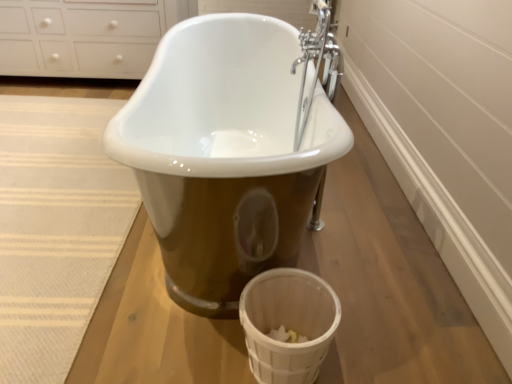
What do you see at coordinates (288, 324) in the screenshot? Image resolution: width=512 pixels, height=384 pixels. I see `white woven basket at lower right` at bounding box center [288, 324].

What are the coordinates of `white glossy cabinet at upper left` in the screenshot? It's located at pos(85,36).

Find the location of a particular element. Image resolution: width=512 pixels, height=384 pixels. white woven basket at lower right is located at coordinates (288, 324).

Is white woven basket at lower right looking in the opposite direction of white glossy cabinet at upper left?

That's not correct — white woven basket at lower right is not looking away from white glossy cabinet at upper left.

From the image's perspective, is white woven basket at lower right positioned above or below white glossy cabinet at upper left?

white woven basket at lower right is situated lower than white glossy cabinet at upper left in the image.

Consider the image. Does white woven basket at lower right have a greater height compared to white glossy cabinet at upper left?

In fact, white woven basket at lower right may be shorter than white glossy cabinet at upper left.

From the image's perspective, which is above, beige woven rug at lower left or white woven basket at lower right?

beige woven rug at lower left, from the image's perspective.

From the picture: Is beige woven rug at lower left with white woven basket at lower right?

beige woven rug at lower left and white woven basket at lower right are clearly separated.

From a real-world perspective, is beige woven rug at lower left beneath white woven basket at lower right?

Yes, from a real-world perspective, beige woven rug at lower left is below white woven basket at lower right.

Is white woven basket at lower right in contact with beige woven rug at lower left?

white woven basket at lower right and beige woven rug at lower left are clearly separated.

Does point (257, 343) appear closer or farther from the camera than point (7, 158)?

Point (257, 343) appears to be closer to the viewer than point (7, 158).

Is white woven basket at lower right positioned with its back to beige woven rug at lower left?

white woven basket at lower right is not turned away from beige woven rug at lower left.

Is white glossy cabinet at upper left with beige woven rug at lower left?

No, white glossy cabinet at upper left is not touching beige woven rug at lower left.

Considering the positions of objects white glossy cabinet at upper left and beige woven rug at lower left in the image provided, who is more to the right, white glossy cabinet at upper left or beige woven rug at lower left?

Positioned to the right is beige woven rug at lower left.

Who is shorter, white glossy cabinet at upper left or beige woven rug at lower left?

Standing shorter between the two is beige woven rug at lower left.

Is beige woven rug at lower left shorter than white glossy cabinet at upper left?

Yes, beige woven rug at lower left is shorter than white glossy cabinet at upper left.

Does beige woven rug at lower left touch white glossy cabinet at upper left?

There is a gap between beige woven rug at lower left and white glossy cabinet at upper left.

Is beige woven rug at lower left outside of white glossy cabinet at upper left?

beige woven rug at lower left is positioned outside white glossy cabinet at upper left.

From the image's perspective, does beige woven rug at lower left appear lower than white glossy cabinet at upper left?

Indeed, from the image's perspective, beige woven rug at lower left is shown beneath white glossy cabinet at upper left.

Is white glossy cabinet at upper left oriented towards white woven basket at lower right?

Yes, white glossy cabinet at upper left is aimed at white woven basket at lower right.

In the image, there is a white woven basket at lower right. Find the location of `cabinetry above it (from the image's perspective)`. cabinetry above it (from the image's perspective) is located at coordinates (85, 36).

Considering their positions, is white glossy cabinet at upper left located in front of or behind white woven basket at lower right?

Clearly, white glossy cabinet at upper left is behind white woven basket at lower right.

What's the angular difference between white glossy cabinet at upper left and white woven basket at lower right's facing directions?

The angle between the facing direction of white glossy cabinet at upper left and the facing direction of white woven basket at lower right is 89 degrees.

Where is `cabinetry on the left of white woven basket at lower right`? Image resolution: width=512 pixels, height=384 pixels. cabinetry on the left of white woven basket at lower right is located at coordinates (85, 36).

The height and width of the screenshot is (384, 512). In order to click on basket below the beige woven rug at lower left (from the image's perspective) in this screenshot , I will do `click(288, 324)`.

From the image, which object appears to be farther from beige woven rug at lower left, white glossy cabinet at upper left or white woven basket at lower right?

white glossy cabinet at upper left.

Based on their spatial positions, is beige woven rug at lower left or white glossy cabinet at upper left further from white woven basket at lower right?

white glossy cabinet at upper left is positioned further to the anchor white woven basket at lower right.

Looking at this image, which object lies nearer to the anchor point white glossy cabinet at upper left, beige woven rug at lower left or white woven basket at lower right?

beige woven rug at lower left.

From the image, which object appears to be farther from beige woven rug at lower left, white woven basket at lower right or white glossy cabinet at upper left?

white glossy cabinet at upper left.

Estimate the real-world distances between objects in this image. Which object is closer to white woven basket at lower right, white glossy cabinet at upper left or beige woven rug at lower left?

Based on the image, beige woven rug at lower left appears to be nearer to white woven basket at lower right.

Based on their spatial positions, is white woven basket at lower right or beige woven rug at lower left further from white glossy cabinet at upper left?

The object further to white glossy cabinet at upper left is white woven basket at lower right.

You are a GUI agent. You are given a task and a screenshot of the screen. Output one action in this format:
    pyautogui.click(x=<x>, y=<y>)
    Task: Click on the bath mat between white woven basket at lower right and white glossy cabinet at upper left in the front-back direction
    This screenshot has height=384, width=512.
    Given the screenshot: What is the action you would take?
    55,229